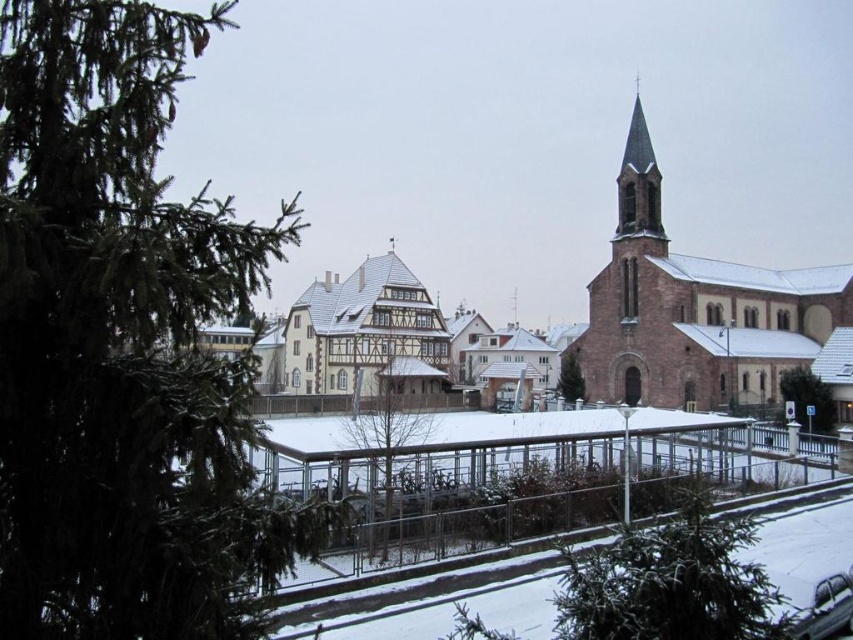
You are a delivery person trying to deliver a package to the half timbered house on the left. You see the clear glass fence at center and the green matte tree at lower right. Which object is closer to you as you approach the house?

The clear glass fence at center is closer to you than the green matte tree at lower right, so you will see it first as you approach the house.